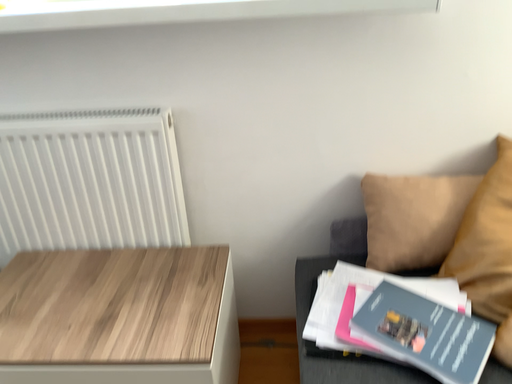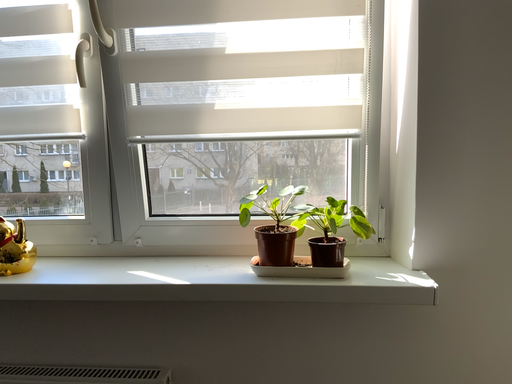
Question: How did the camera likely rotate when shooting the video?

Choices:
 (A) rotated downward
 (B) rotated upward

Answer: (B)